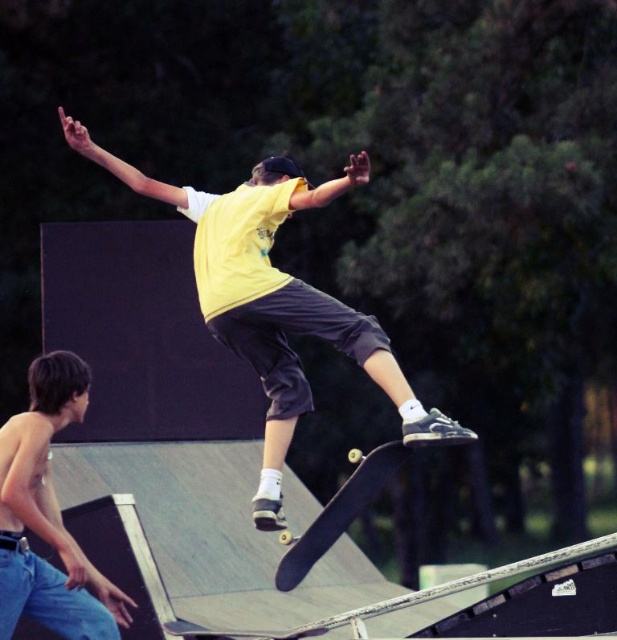
You are a photographer at the skate park and want to capture both the yellow matte shirt at center and the shiny blue jeans at lower left in a single shot. Which subject should you focus on first to ensure both are in frame?

You should focus on the shiny blue jeans at lower left first because the yellow matte shirt at center is not as tall as it, ensuring both will be in frame.

You are standing at the skate park and want to take a photo of the point at coordinates point (263, 321). If your camera has a maximum focus range of 15 meters, will you be able to focus on that point?

The distance of point (263, 321) from viewer is 15.44 meters, which exceeds the camera maximum focus range of 15 meters. Therefore, you won not be able to focus on that point.

From the picture: You are a photographer at the skate park and want to capture a photo of both the shiny blue jeans at lower left and the black smooth skateboard at center. Based on their positions, which object should you focus on first to ensure both are in the frame?

The shiny blue jeans at lower left is located above the black smooth skateboard at center, so you should focus on the black smooth skateboard at center first to ensure both are in the frame.